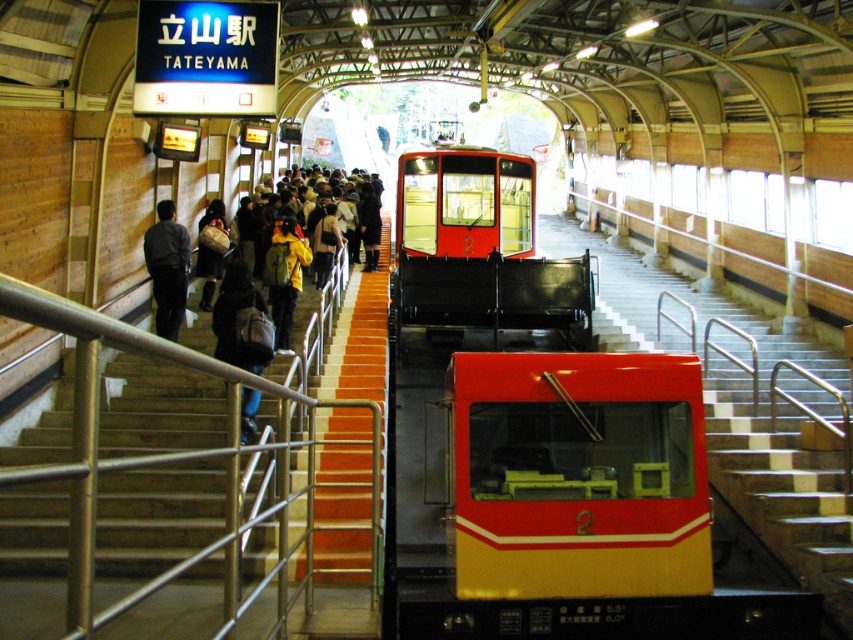
Is point (192, 394) positioned before point (492, 310)?

Yes.

Is wooden stairs at center further to camera compared to matte black train at center?

No, it is in front of matte black train at center.

Is point (195, 442) in front of point (532, 326)?

Yes.

Where is `wooden stairs at center`? This screenshot has width=853, height=640. wooden stairs at center is located at coordinates (155, 516).

Is point (775, 529) positioned in front of point (271, 292)?

Yes, point (775, 529) is in front of point (271, 292).

Which is in front, point (670, 307) or point (286, 284)?

Positioned in front is point (286, 284).

Does point (738, 433) come in front of point (300, 252)?

Yes, point (738, 433) is closer to viewer.

In order to click on wooden staircase at center in this screenshot , I will do `click(735, 413)`.

Which of these two, dark gray fabric jacket at left or dark blue denim jeans at center, stands taller?

dark gray fabric jacket at left is taller.

Is point (166, 328) closer to camera compared to point (215, 307)?

No.

Image resolution: width=853 pixels, height=640 pixels. Find the location of `dark gray fabric jacket at left`. dark gray fabric jacket at left is located at coordinates (167, 268).